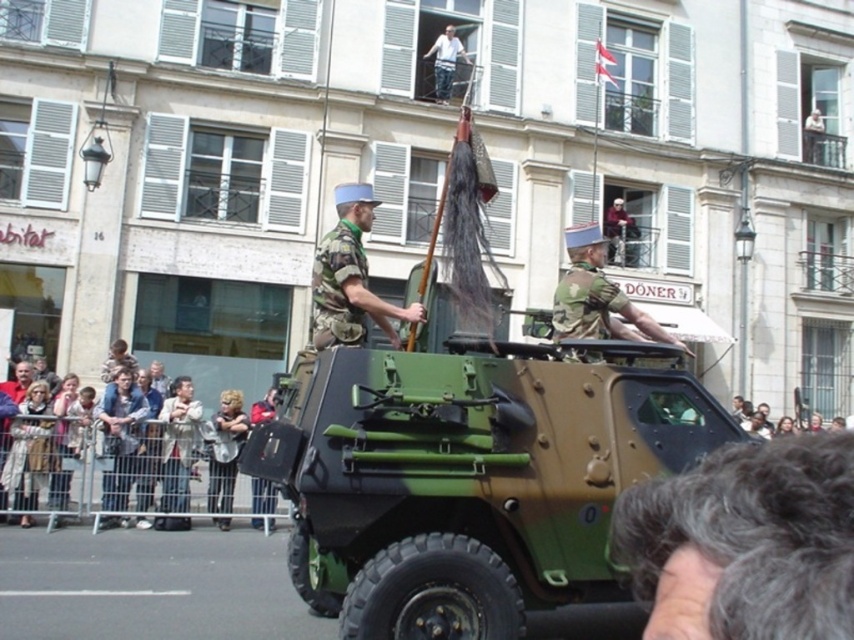
Does gray curly hair at lower right have a greater height compared to striped fabric jacket at lower left?

In fact, gray curly hair at lower right may be shorter than striped fabric jacket at lower left.

Consider the image. Is gray curly hair at lower right to the right of striped fabric jacket at lower left from the viewer's perspective?

Yes, gray curly hair at lower right is to the right of striped fabric jacket at lower left.

What do you see at coordinates (744, 541) in the screenshot? I see `gray curly hair at lower right` at bounding box center [744, 541].

This screenshot has height=640, width=854. Identify the location of gray curly hair at lower right. (744, 541).

Can you confirm if camouflage uniform at center is thinner than light brown wooden fence at lower left?

Yes.

Who is more forward, (583, 253) or (243, 356)?

Point (583, 253) is in front.

The width and height of the screenshot is (854, 640). Describe the element at coordinates (595, 296) in the screenshot. I see `camouflage uniform at center` at that location.

What are the coordinates of `camouflage uniform at center` in the screenshot? It's located at (595, 296).

Can you confirm if camouflage fabric uniform at center is bigger than white cotton shirt at upper center?

No, camouflage fabric uniform at center is not bigger than white cotton shirt at upper center.

This screenshot has height=640, width=854. Describe the element at coordinates (349, 276) in the screenshot. I see `camouflage fabric uniform at center` at that location.

In the scene shown: Who is more forward, (358, 216) or (437, 80)?

Positioned in front is point (358, 216).

The width and height of the screenshot is (854, 640). Find the location of `camouflage fabric uniform at center`. camouflage fabric uniform at center is located at coordinates (349, 276).